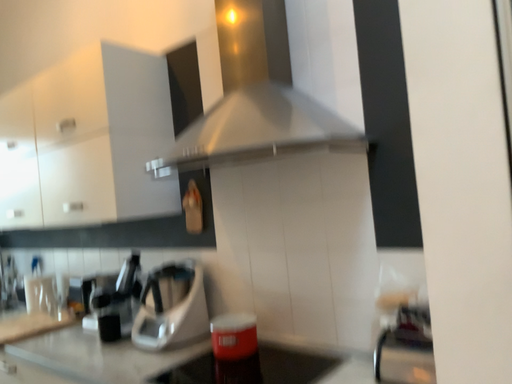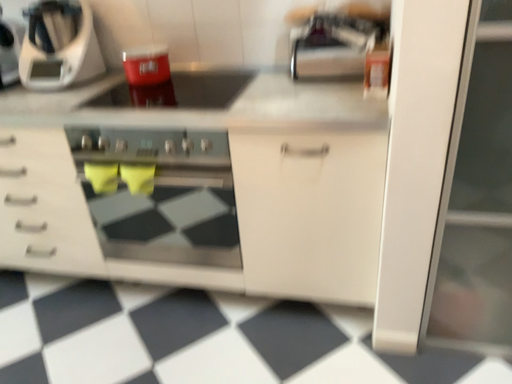
Question: How did the camera likely rotate when shooting the video?

Choices:
 (A) rotated left
 (B) rotated right

Answer: (B)